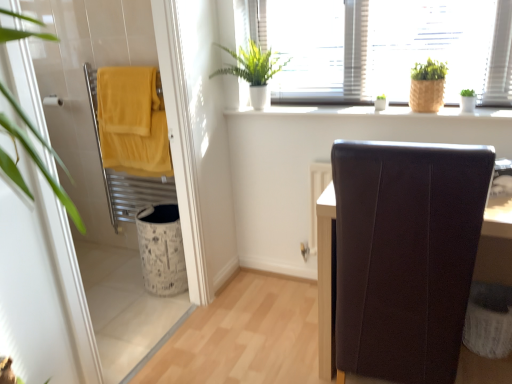
Find the location of a particular element. The image size is (512, 384). vacant space situated above matte yellow towel at left (from a real-world perspective) is located at coordinates (123, 100).